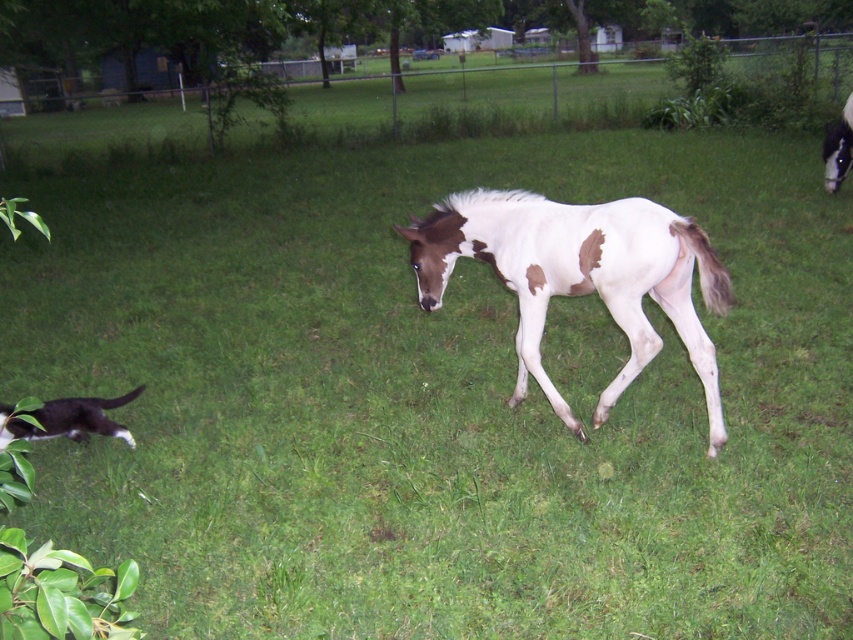
Can you confirm if white speckled horse at center is positioned below black and white fur pony at lower left?

Incorrect, white speckled horse at center is not positioned below black and white fur pony at lower left.

At what (x,y) coordinates should I click in order to perform the action: click on white speckled horse at center. Please return your answer as a coordinate pair (x, y). This screenshot has height=640, width=853. Looking at the image, I should click on (579, 276).

Does point (657, 204) come farther from viewer compared to point (50, 408)?

Yes.

Locate an element on the screen. Image resolution: width=853 pixels, height=640 pixels. white speckled horse at center is located at coordinates (579, 276).

Which is below, black and white fur pony at lower left or white glossy horse at upper right?

black and white fur pony at lower left

Between black and white fur pony at lower left and white glossy horse at upper right, which one is positioned higher?

white glossy horse at upper right

What do you see at coordinates (71, 419) in the screenshot?
I see `black and white fur pony at lower left` at bounding box center [71, 419].

Identify the location of black and white fur pony at lower left. (71, 419).

The height and width of the screenshot is (640, 853). In order to click on white speckled horse at center in this screenshot , I will do pos(579,276).

Does point (564, 417) lie in front of point (842, 173)?

Yes, it is.

Who is more forward, (502, 220) or (834, 124)?

Point (502, 220)

Find the location of a particular element. white speckled horse at center is located at coordinates (579, 276).